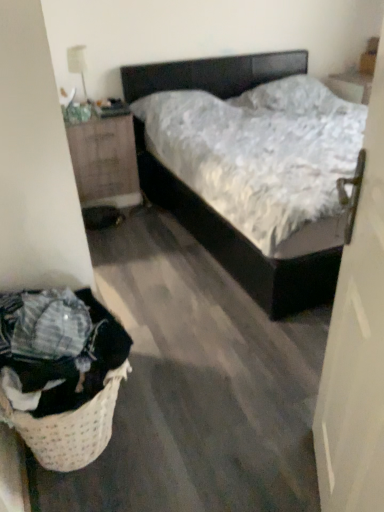
Question: Is white glossy lamp at upper left facing towards white matte door at right?

Choices:
 (A) yes
 (B) no

Answer: (A)

Question: Is white glossy lamp at upper left not near white matte door at right?

Choices:
 (A) yes
 (B) no

Answer: (A)

Question: Considering the relative sizes of white glossy lamp at upper left and white matte door at right in the image provided, is white glossy lamp at upper left smaller than white matte door at right?

Choices:
 (A) no
 (B) yes

Answer: (B)

Question: Is white matte door at right located within white glossy lamp at upper left?

Choices:
 (A) yes
 (B) no

Answer: (B)

Question: Is white glossy lamp at upper left bigger than white matte door at right?

Choices:
 (A) yes
 (B) no

Answer: (B)

Question: In terms of width, does wooden nightstand at left look wider or thinner when compared to white matte door at right?

Choices:
 (A) wide
 (B) thin

Answer: (A)

Question: Choose the correct answer: Is wooden nightstand at left inside white matte door at right or outside it?

Choices:
 (A) inside
 (B) outside

Answer: (B)

Question: From the image's perspective, is wooden nightstand at left located above or below white matte door at right?

Choices:
 (A) below
 (B) above

Answer: (B)

Question: Considering the positions of point (117, 135) and point (365, 345), is point (117, 135) closer or farther from the camera than point (365, 345)?

Choices:
 (A) farther
 (B) closer

Answer: (A)

Question: Is wooden nightstand at left bigger or smaller than woven beige laundry basket at lower left?

Choices:
 (A) big
 (B) small

Answer: (A)

Question: Considering the positions of point (107, 188) and point (97, 365), is point (107, 188) closer or farther from the camera than point (97, 365)?

Choices:
 (A) closer
 (B) farther

Answer: (B)

Question: From the image's perspective, is wooden nightstand at left above or below woven beige laundry basket at lower left?

Choices:
 (A) below
 (B) above

Answer: (B)

Question: From a real-world perspective, relative to woven beige laundry basket at lower left, is wooden nightstand at left vertically above or below?

Choices:
 (A) above
 (B) below

Answer: (A)

Question: From a real-world perspective, relative to white matte door at right, is matte black bed at center vertically above or below?

Choices:
 (A) below
 (B) above

Answer: (A)

Question: In terms of height, does matte black bed at center look taller or shorter compared to white matte door at right?

Choices:
 (A) short
 (B) tall

Answer: (A)